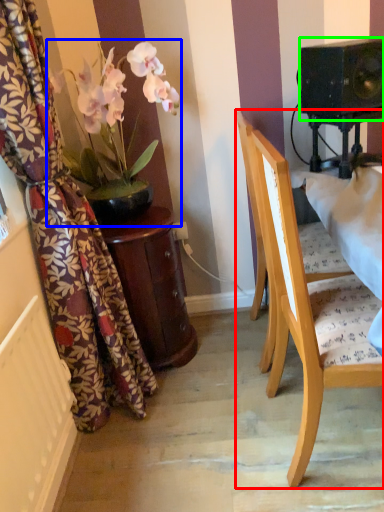
Question: Which is nearer to the chair (highlighted by a red box)? houseplant (highlighted by a blue box) or speaker (highlighted by a green box).

Choices:
 (A) houseplant
 (B) speaker

Answer: (B)